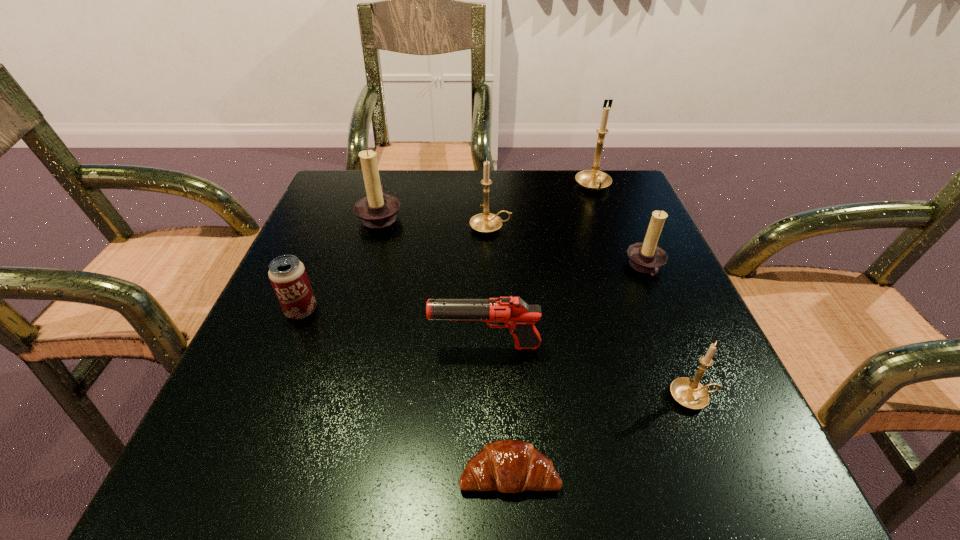
Find the location of a particular element. The height and width of the screenshot is (540, 960). the tallest object is located at coordinates (593, 179).

Locate an element on the screen. This screenshot has width=960, height=540. the tallest candle holder is located at coordinates (593, 179).

You are a GUI agent. You are given a task and a screenshot of the screen. Output one action in this format:
    pyautogui.click(x=<x>, y=<y>)
    Task: Click on the left brown candle holder
    The image size is (960, 540).
    Given the screenshot: What is the action you would take?
    pyautogui.click(x=377, y=210)

The image size is (960, 540). In order to click on the leftmost candle holder in this screenshot , I will do `click(377, 210)`.

I want to click on the leftmost gold candle holder, so click(485, 222).

Identify the location of the fourth candle holder from right to left. The width and height of the screenshot is (960, 540). (485, 222).

Where is `the fourth farthest object`? This screenshot has width=960, height=540. the fourth farthest object is located at coordinates (647, 257).

The image size is (960, 540). In order to click on the smaller brown candle holder in this screenshot , I will do `click(647, 257)`.

Where is `the nearest gold candle holder`? the nearest gold candle holder is located at coordinates (688, 392).

Locate an element on the screen. The height and width of the screenshot is (540, 960). the nearest candle holder is located at coordinates (688, 392).